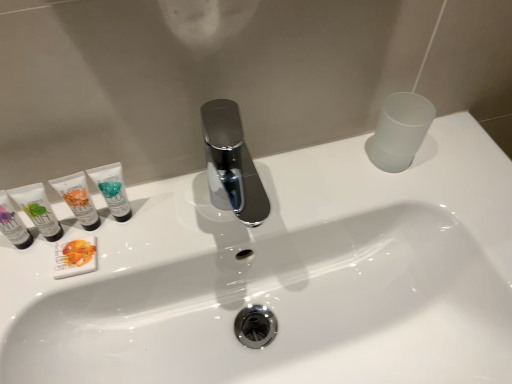
At what (x,y) coordinates should I click in order to perform the action: click on blank space above white glossy sink at center (from a real-world perspective). Please return your answer as a coordinate pair (x, y). Looking at the image, I should click on (295, 209).